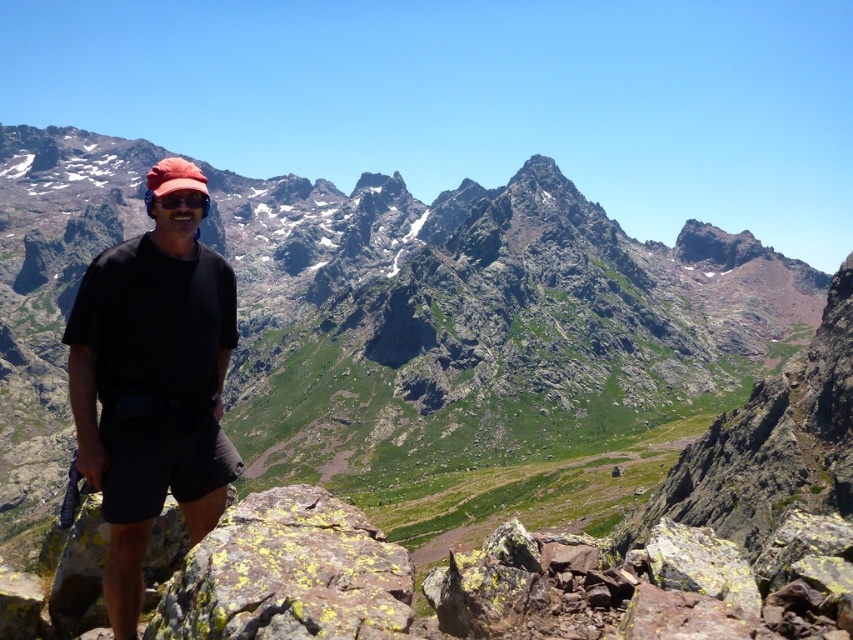
Can you confirm if yellow lichen-covered rock at lower center is wider than transparent plastic goggles at center?

Yes.

Is yellow lichen-covered rock at lower center thinner than transparent plastic goggles at center?

Incorrect, yellow lichen-covered rock at lower center's width is not less than transparent plastic goggles at center's.

Which is in front, point (340, 509) or point (201, 205)?

Point (201, 205) is more forward.

At what (x,y) coordinates should I click in order to perform the action: click on yellow lichen-covered rock at lower center. Please return your answer as a coordinate pair (x, y). The height and width of the screenshot is (640, 853). Looking at the image, I should click on (288, 573).

Who is more distant from viewer, (105, 387) or (306, 564)?

Positioned behind is point (105, 387).

Can you confirm if black matte shirt at center is positioned above yellow lichen-covered rock at lower center?

Yes.

Identify the location of black matte shirt at center. This screenshot has width=853, height=640. (152, 392).

Where is `black matte shirt at center`? black matte shirt at center is located at coordinates (152, 392).